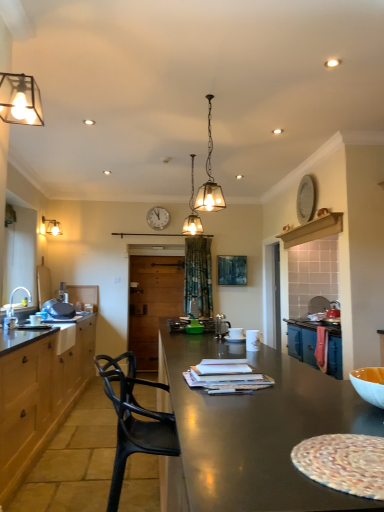
Question: Is black plastic chair at center inside or outside of matte glass lampshade at upper left, which is the first lamp from back to front?

Choices:
 (A) outside
 (B) inside

Answer: (A)

Question: Considering their positions, is black plastic chair at center located in front of or behind matte glass lampshade at upper left, acting as the fourth lamp starting from the right?

Choices:
 (A) front
 (B) behind

Answer: (A)

Question: Which object is the farthest from the white wooden clock at upper center?

Choices:
 (A) translucent glass pendant light at center, which ranks as the third lamp in front-to-back order
 (B) matte glass lamp at upper left, arranged as the 1th lamp when viewed from the front
 (C) matte glass lampshade at upper left, the 4th lamp from the front
 (D) satin silver coffee pot at center
 (E) matte brown countertop at left

Answer: (B)

Question: Based on their relative distances, which object is farther from the matte glass pendant light at center, acting as the 4th lamp starting from the left?

Choices:
 (A) translucent glass pendant light at center, positioned as the 3th lamp in left-to-right order
 (B) white wooden clock at upper center
 (C) satin silver coffee pot at center
 (D) matte glass lampshade at upper left, which is the 1th lamp in left-to-right order
 (E) white glossy sink at left

Answer: (D)